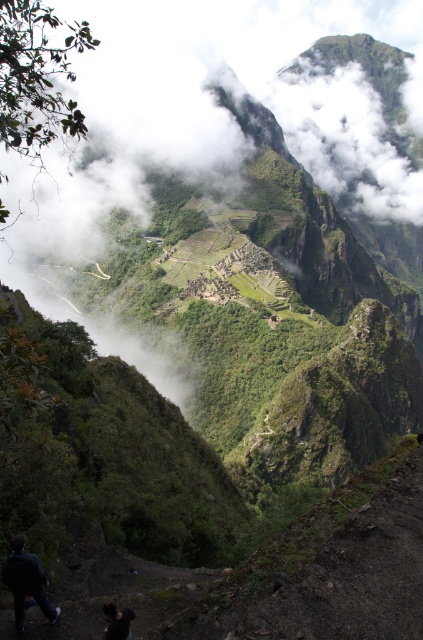
Question: Among these objects, which one is nearest to the camera?

Choices:
 (A) dark blue jacket at lower left
 (B) dark brown hair at lower left

Answer: (B)

Question: Is dark blue jacket at lower left smaller than dark brown hair at lower left?

Choices:
 (A) no
 (B) yes

Answer: (A)

Question: Considering the relative positions of dark blue jacket at lower left and dark brown hair at lower left in the image provided, where is dark blue jacket at lower left located with respect to dark brown hair at lower left?

Choices:
 (A) above
 (B) below

Answer: (A)

Question: Is dark blue jacket at lower left positioned at the back of dark brown hair at lower left?

Choices:
 (A) yes
 (B) no

Answer: (A)

Question: Among these points, which one is farthest from the camera?

Choices:
 (A) (16, 618)
 (B) (109, 604)

Answer: (B)

Question: Which point appears farthest from the camera in this image?

Choices:
 (A) (21, 576)
 (B) (115, 624)

Answer: (A)